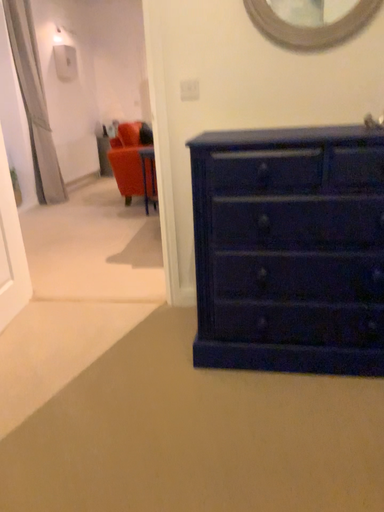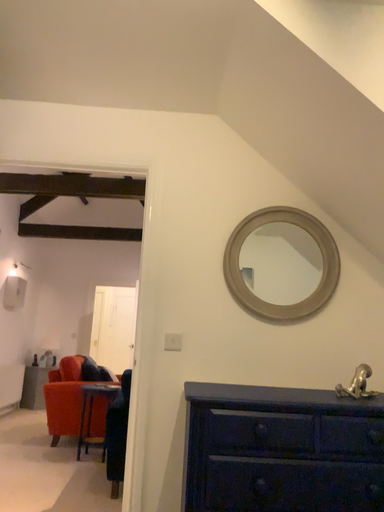
Question: Which way did the camera rotate in the video?

Choices:
 (A) rotated upward
 (B) rotated downward

Answer: (A)